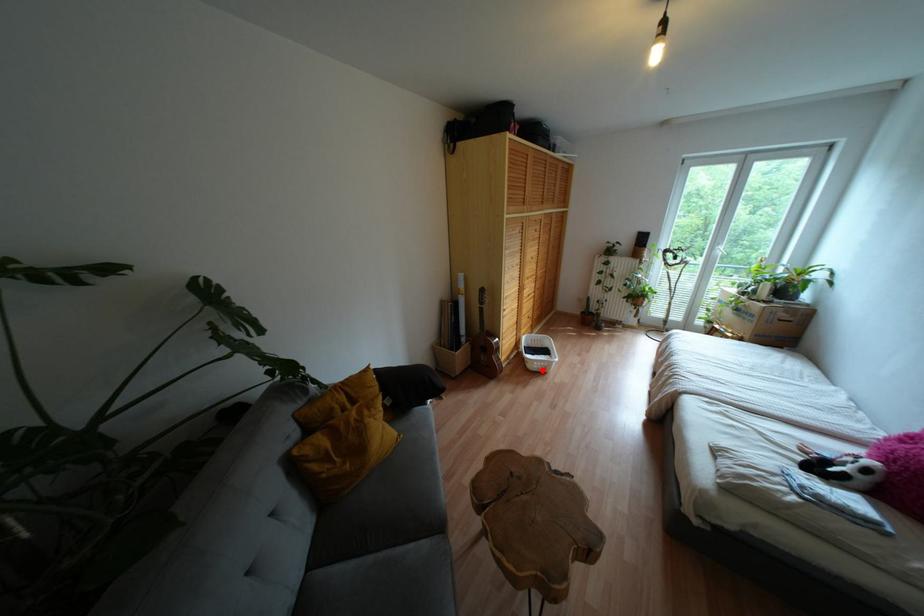
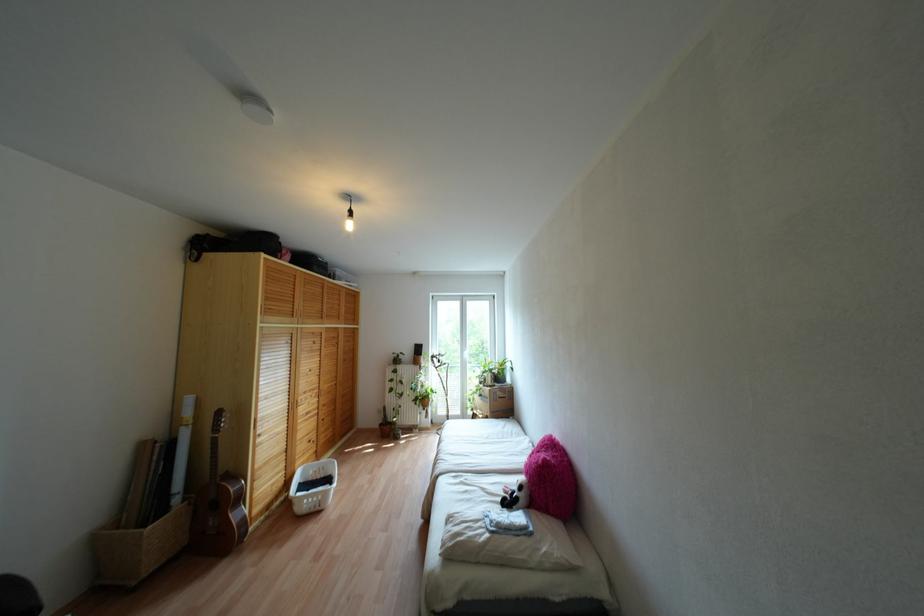
Question: I am providing you with two images of the same scene from different viewpoints. In image1, a red point is highlighted. Considering the same 3D point in image2, which of the following is correct?

Choices:
 (A) It is closer
 (B) It is farther

Answer: (B)